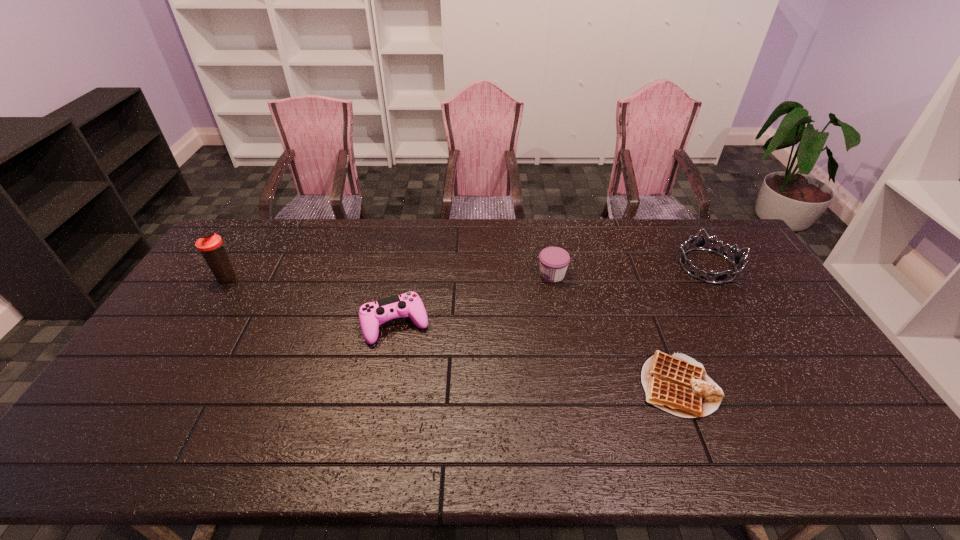
Image resolution: width=960 pixels, height=540 pixels. What are the coordinates of `free location located 0.360m on the front label of the jam` in the screenshot? It's located at (430, 275).

Locate an element on the screen. Image resolution: width=960 pixels, height=540 pixels. blank space located 0.370m on the front label of the jam is located at coordinates (427, 275).

This screenshot has width=960, height=540. I want to click on free location located 0.360m on the front-facing side of the tiara, so click(x=570, y=266).

Where is `vacant space located on the front-facing side of the tiara`? Image resolution: width=960 pixels, height=540 pixels. vacant space located on the front-facing side of the tiara is located at coordinates pos(657,266).

Identify the location of blank space located on the front-facing side of the tiara. The image size is (960, 540). (588, 266).

Where is `free space located on the back of the control`? The height and width of the screenshot is (540, 960). free space located on the back of the control is located at coordinates (410, 248).

This screenshot has width=960, height=540. Find the location of `free space located on the right of the waffle`. free space located on the right of the waffle is located at coordinates (778, 386).

Locate an element on the screen. object that is at the far edge is located at coordinates (700, 244).

Where is `object present at the left edge`? This screenshot has height=540, width=960. object present at the left edge is located at coordinates (210, 245).

The width and height of the screenshot is (960, 540). I want to click on object that is positioned at the right edge, so click(700, 244).